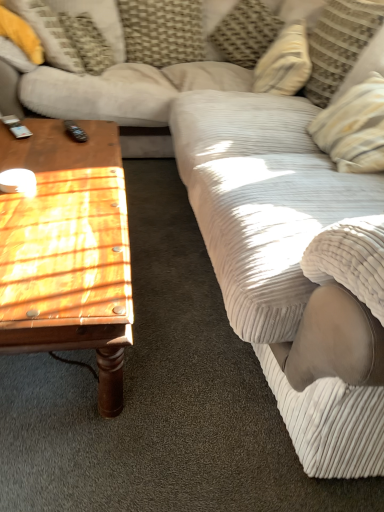
How much space does textured beige pillow at upper center, arranged as the 2th pillow when viewed from the right, occupy horizontally?

12.31 inches.

What do you see at coordinates (75, 131) in the screenshot? I see `black plastic remote at left` at bounding box center [75, 131].

Image resolution: width=384 pixels, height=512 pixels. What do you see at coordinates (21, 34) in the screenshot?
I see `yellow fabric pillow at upper left, the first pillow when ordered from left to right` at bounding box center [21, 34].

In order to face wooden polished coffee table at left, should I rotate leftwards or rightwards?

Rotate your view left by about 19.443°.

At what (x,y) coordinates should I click in order to perform the action: click on striped fabric pillow at upper right, arranged as the first pillow when viewed from the right. Please return your answer as a coordinate pair (x, y). Image resolution: width=384 pixels, height=512 pixels. Looking at the image, I should click on (339, 44).

Is striped fabric pillow at upper right, arranged as the first pillow when viewed from the right, at the back of wooden polished coffee table at left?

No, striped fabric pillow at upper right, arranged as the first pillow when viewed from the right, is not at the back of wooden polished coffee table at left.

Which is correct: wooden polished coffee table at left is inside striped fabric pillow at upper right, the fourth pillow from the left, or outside of it?

wooden polished coffee table at left is outside striped fabric pillow at upper right, the fourth pillow from the left.

Find the location of `the 1st pillow above the wooden polished coffee table at left (from the image's perspective)`. the 1st pillow above the wooden polished coffee table at left (from the image's perspective) is located at coordinates pos(339,44).

Is wooden polished coffee table at left positioned far away from striped fabric pillow at upper right, the fourth pillow from the left?

wooden polished coffee table at left is far away from striped fabric pillow at upper right, the fourth pillow from the left.

From a real-world perspective, who is located higher, textured beige pillow at upper center, arranged as the 2th pillow when viewed from the right, or black plastic remote at left?

From a 3D spatial view, textured beige pillow at upper center, arranged as the 2th pillow when viewed from the right, is above.

Which of these two, textured beige pillow at upper center, arranged as the 2th pillow when viewed from the right, or black plastic remote at left, is smaller?

Smaller between the two is black plastic remote at left.

Can you tell me how much textured beige pillow at upper center, arranged as the 2th pillow when viewed from the right, and black plastic remote at left differ in facing direction?

The angular difference between textured beige pillow at upper center, arranged as the 2th pillow when viewed from the right, and black plastic remote at left is 153 degrees.

How different are the orientations of woven fabric pillow at upper center, positioned as the 2th pillow in left-to-right order, and textured beige pillow at upper center, arranged as the 2th pillow when viewed from the right, in degrees?

6.25 degrees.

From a real-world perspective, does woven fabric pillow at upper center, the third pillow positioned from the right, sit lower than textured beige pillow at upper center, acting as the 3th pillow starting from the left?

Yes, from a real-world perspective, woven fabric pillow at upper center, the third pillow positioned from the right, is beneath textured beige pillow at upper center, acting as the 3th pillow starting from the left.

Can you confirm if woven fabric pillow at upper center, positioned as the 2th pillow in left-to-right order, is taller than textured beige pillow at upper center, acting as the 3th pillow starting from the left?

Yes, woven fabric pillow at upper center, positioned as the 2th pillow in left-to-right order, is taller than textured beige pillow at upper center, acting as the 3th pillow starting from the left.

Between yellow fabric pillow at upper left, which is counted as the fourth pillow, starting from the right, and black plastic remote at left, which one is positioned behind?

yellow fabric pillow at upper left, which is counted as the fourth pillow, starting from the right, is behind.

Considering the sizes of objects yellow fabric pillow at upper left, which is counted as the fourth pillow, starting from the right, and black plastic remote at left in the image provided, who is bigger, yellow fabric pillow at upper left, which is counted as the fourth pillow, starting from the right, or black plastic remote at left?

yellow fabric pillow at upper left, which is counted as the fourth pillow, starting from the right.

From the image's perspective, which object appears higher, yellow fabric pillow at upper left, the first pillow when ordered from left to right, or black plastic remote at left?

yellow fabric pillow at upper left, the first pillow when ordered from left to right, appears higher in the image.

Considering the sizes of objects yellow fabric pillow at upper left, which is counted as the fourth pillow, starting from the right, and black plastic remote at left in the image provided, who is shorter, yellow fabric pillow at upper left, which is counted as the fourth pillow, starting from the right, or black plastic remote at left?

Standing shorter between the two is black plastic remote at left.

Is yellow fabric pillow at upper left, the first pillow when ordered from left to right, closer to camera compared to striped fabric pillow at upper right, arranged as the first pillow when viewed from the right?

No.

Considering the relative sizes of yellow fabric pillow at upper left, the first pillow when ordered from left to right, and striped fabric pillow at upper right, arranged as the first pillow when viewed from the right, in the image provided, is yellow fabric pillow at upper left, the first pillow when ordered from left to right, thinner than striped fabric pillow at upper right, arranged as the first pillow when viewed from the right,?

In fact, yellow fabric pillow at upper left, the first pillow when ordered from left to right, might be wider than striped fabric pillow at upper right, arranged as the first pillow when viewed from the right.

From the image's perspective, between yellow fabric pillow at upper left, which is counted as the fourth pillow, starting from the right, and striped fabric pillow at upper right, the fourth pillow from the left, who is located below?

striped fabric pillow at upper right, the fourth pillow from the left, appears lower in the image.

Is yellow fabric pillow at upper left, which is counted as the fourth pillow, starting from the right, positioned beyond the bounds of striped fabric pillow at upper right, arranged as the first pillow when viewed from the right?

Yes, yellow fabric pillow at upper left, which is counted as the fourth pillow, starting from the right, is outside of striped fabric pillow at upper right, arranged as the first pillow when viewed from the right.

Is wooden polished coffee table at left to the left or to the right of yellow fabric pillow at upper left, which is counted as the fourth pillow, starting from the right, in the image?

From the image, it's evident that wooden polished coffee table at left is to the right of yellow fabric pillow at upper left, which is counted as the fourth pillow, starting from the right.

Are wooden polished coffee table at left and yellow fabric pillow at upper left, the first pillow when ordered from left to right, located far from each other?

wooden polished coffee table at left is far away from yellow fabric pillow at upper left, the first pillow when ordered from left to right.

What's the angular difference between wooden polished coffee table at left and yellow fabric pillow at upper left, the first pillow when ordered from left to right,'s facing directions?

90.9 degrees.

Is textured beige pillow at upper center, acting as the 3th pillow starting from the left, in front of or behind yellow fabric pillow at upper left, which is counted as the fourth pillow, starting from the right, in the image?

Visually, textured beige pillow at upper center, acting as the 3th pillow starting from the left, is located behind yellow fabric pillow at upper left, which is counted as the fourth pillow, starting from the right.

Identify the location of the 2nd pillow above when counting from the yellow fabric pillow at upper left, which is counted as the fourth pillow, starting from the right (from the image's perspective). Image resolution: width=384 pixels, height=512 pixels. (246, 33).

From a real-world perspective, relative to yellow fabric pillow at upper left, which is counted as the fourth pillow, starting from the right, is textured beige pillow at upper center, acting as the 3th pillow starting from the left, vertically above or below?

Clearly, from a real-world perspective, textured beige pillow at upper center, acting as the 3th pillow starting from the left, is below yellow fabric pillow at upper left, which is counted as the fourth pillow, starting from the right.

Is textured beige pillow at upper center, acting as the 3th pillow starting from the left, outside of yellow fabric pillow at upper left, the first pillow when ordered from left to right?

Indeed, textured beige pillow at upper center, acting as the 3th pillow starting from the left, is completely outside yellow fabric pillow at upper left, the first pillow when ordered from left to right.

Locate an element on the screen. The image size is (384, 512). the 1st pillow behind when counting from the wooden polished coffee table at left is located at coordinates (339, 44).

You are a GUI agent. You are given a task and a screenshot of the screen. Output one action in this format:
    pyautogui.click(x=<x>, y=<y>)
    Task: Click on the remote in front of the textured beige pillow at upper center, arranged as the 2th pillow when viewed from the right
    
    Given the screenshot: What is the action you would take?
    pyautogui.click(x=75, y=131)

Estimate the real-world distances between objects in this image. Which object is further from woven fabric pillow at upper center, the third pillow positioned from the right, black plastic remote at left or wooden polished coffee table at left?

Based on the image, wooden polished coffee table at left appears to be further to woven fabric pillow at upper center, the third pillow positioned from the right.

Estimate the real-world distances between objects in this image. Which object is further from yellow fabric pillow at upper left, the first pillow when ordered from left to right, wooden polished coffee table at left or black plastic remote at left?

wooden polished coffee table at left is positioned further to the anchor yellow fabric pillow at upper left, the first pillow when ordered from left to right.

Looking at the image, which one is located further to striped fabric pillow at upper right, the fourth pillow from the left, textured beige pillow at upper center, acting as the 3th pillow starting from the left, or woven fabric pillow at upper center, the third pillow positioned from the right?

Among the two, woven fabric pillow at upper center, the third pillow positioned from the right, is located further to striped fabric pillow at upper right, the fourth pillow from the left.

Considering their positions, is striped fabric pillow at upper right, arranged as the first pillow when viewed from the right, positioned further to textured beige pillow at upper center, arranged as the 2th pillow when viewed from the right, than woven fabric pillow at upper center, positioned as the 2th pillow in left-to-right order?

The object further to textured beige pillow at upper center, arranged as the 2th pillow when viewed from the right, is striped fabric pillow at upper right, arranged as the first pillow when viewed from the right.

Which object lies further to the anchor point wooden polished coffee table at left, textured beige pillow at upper center, arranged as the 2th pillow when viewed from the right, or black plastic remote at left?

textured beige pillow at upper center, arranged as the 2th pillow when viewed from the right, is positioned further to the anchor wooden polished coffee table at left.

From the image, which object appears to be farther from woven fabric pillow at upper center, positioned as the 2th pillow in left-to-right order, textured beige pillow at upper center, acting as the 3th pillow starting from the left, or black plastic remote at left?

The object further to woven fabric pillow at upper center, positioned as the 2th pillow in left-to-right order, is black plastic remote at left.

Which object lies further to the anchor point striped fabric pillow at upper right, the fourth pillow from the left, textured beige pillow at upper center, acting as the 3th pillow starting from the left, or black plastic remote at left?

Based on the image, black plastic remote at left appears to be further to striped fabric pillow at upper right, the fourth pillow from the left.

Which object lies further to the anchor point black plastic remote at left, woven fabric pillow at upper center, the third pillow positioned from the right, or striped fabric pillow at upper right, the fourth pillow from the left?

Based on the image, woven fabric pillow at upper center, the third pillow positioned from the right, appears to be further to black plastic remote at left.

Where is `remote that lies between yellow fabric pillow at upper left, the first pillow when ordered from left to right, and wooden polished coffee table at left from top to bottom`? The height and width of the screenshot is (512, 384). remote that lies between yellow fabric pillow at upper left, the first pillow when ordered from left to right, and wooden polished coffee table at left from top to bottom is located at coordinates (75, 131).

You are a GUI agent. You are given a task and a screenshot of the screen. Output one action in this format:
    pyautogui.click(x=<x>, y=<y>)
    Task: Click on the pillow situated between yellow fabric pillow at upper left, which is counted as the fourth pillow, starting from the right, and textured beige pillow at upper center, acting as the 3th pillow starting from the left, from left to right
    Image resolution: width=384 pixels, height=512 pixels.
    Given the screenshot: What is the action you would take?
    pos(162,31)

Identify the location of remote positioned between wooden polished coffee table at left and woven fabric pillow at upper center, the third pillow positioned from the right, from near to far. The image size is (384, 512). (75, 131).

The image size is (384, 512). What are the coordinates of `remote positioned between wooden polished coffee table at left and textured beige pillow at upper center, arranged as the 2th pillow when viewed from the right, from near to far` in the screenshot? It's located at (75, 131).